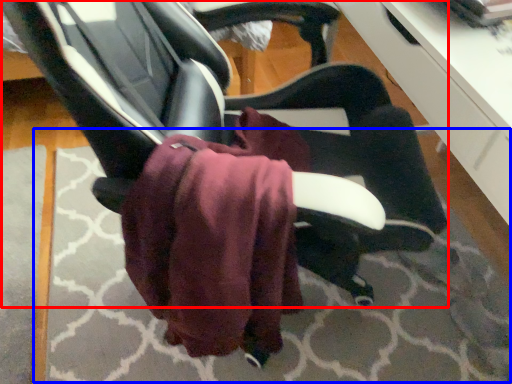
Question: Which object is closer to the camera taking this photo, chair (highlighted by a red box) or mat (highlighted by a blue box)?

Choices:
 (A) chair
 (B) mat

Answer: (A)